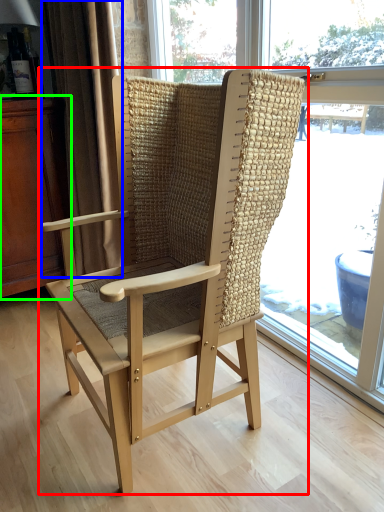
Question: Which object is positioned farthest from chair (highlighted by a red box)? Select from curtain (highlighted by a blue box) and dresser (highlighted by a green box).

Choices:
 (A) curtain
 (B) dresser

Answer: (B)